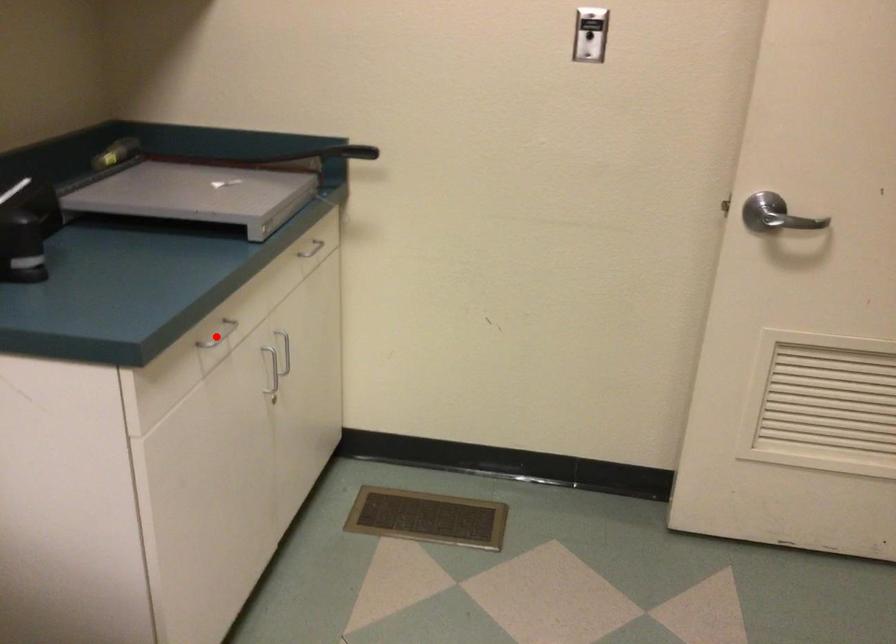
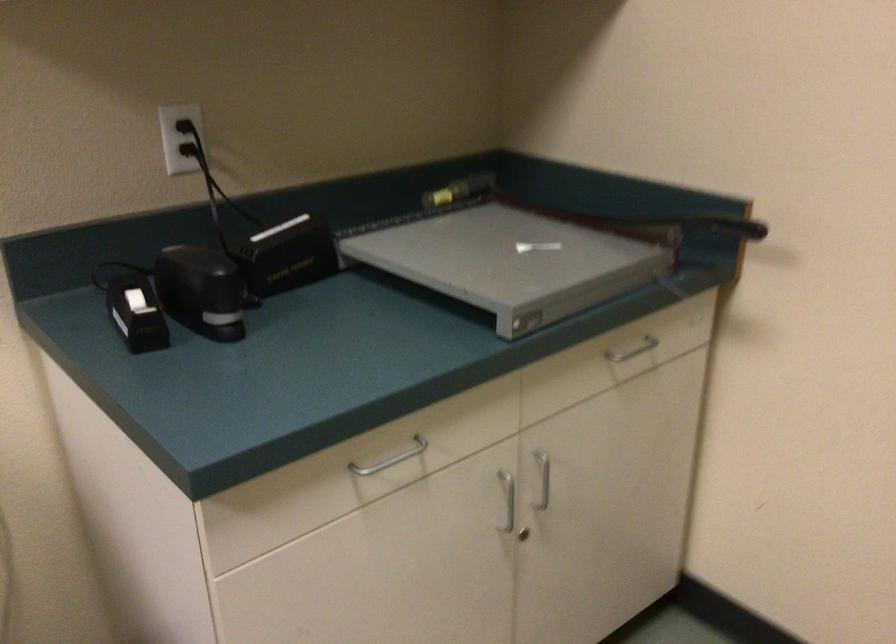
Find the pixel in the second image that matches the highlighted location in the first image.

(391, 459)